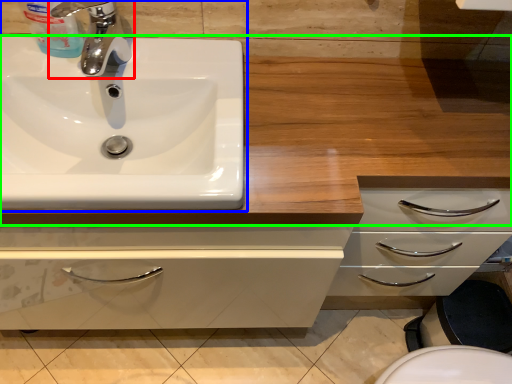
Question: Considering the real-world distances, which object is closest to tap (highlighted by a red box)? sink (highlighted by a blue box) or counter top (highlighted by a green box).

Choices:
 (A) sink
 (B) counter top

Answer: (A)